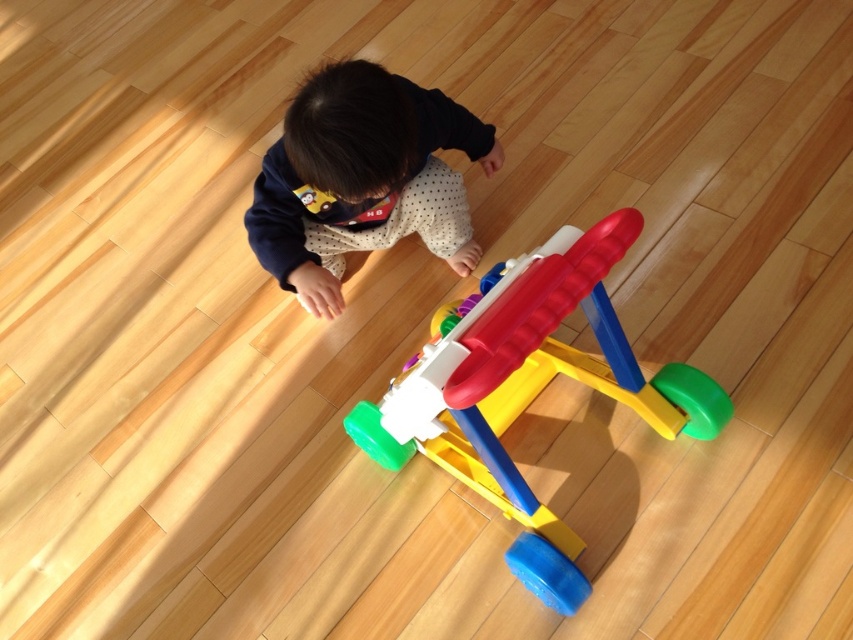
Is point (457, 452) in front of point (410, 113)?

No, (457, 452) is behind (410, 113).

Who is more forward, (474, 410) or (463, 212)?

Point (474, 410) is more forward.

You are a GUI agent. You are given a task and a screenshot of the screen. Output one action in this format:
    pyautogui.click(x=<x>, y=<y>)
    Task: Click on the plastic walker at center
    The width and height of the screenshot is (853, 640).
    Given the screenshot: What is the action you would take?
    pyautogui.click(x=529, y=388)